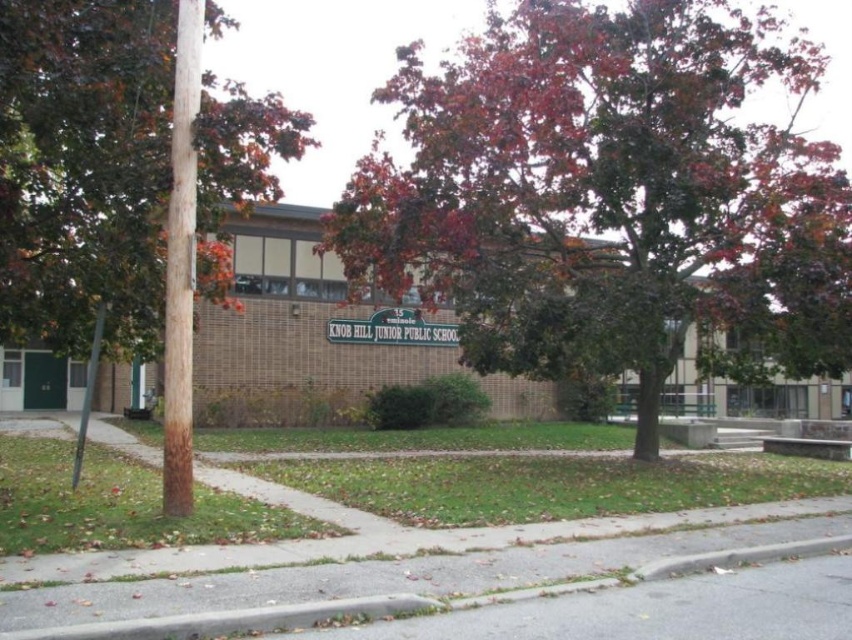
Question: Can you confirm if brown textured pole at left is thinner than green plastic sign at center?

Choices:
 (A) yes
 (B) no

Answer: (B)

Question: Which point is farther to the camera?

Choices:
 (A) (176, 326)
 (B) (60, 324)
 (C) (79, 445)

Answer: (B)

Question: Does autumn leaves at center appear over metallic pole at left?

Choices:
 (A) yes
 (B) no

Answer: (A)

Question: Which point is closer to the camera?

Choices:
 (A) green plastic sign at center
 (B) autumn leaves at center
 (C) brown rough wooden pole at left
 (D) brown textured pole at left

Answer: (D)

Question: Observing the image, what is the correct spatial positioning of brown textured pole at left in reference to green plastic sign at center?

Choices:
 (A) right
 (B) left

Answer: (B)

Question: Which point is farther to the camera?

Choices:
 (A) brown textured pole at left
 (B) metallic pole at left

Answer: (B)